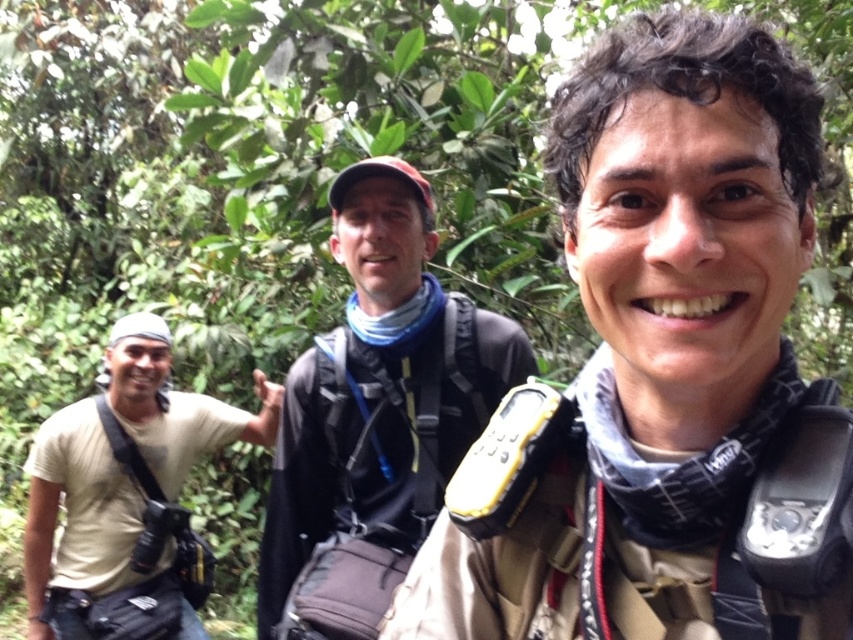
Which is behind, point (695, 248) or point (178, 625)?

The point (178, 625) is more distant.

Between matte black backpack at center and light beige t-shirt at left, which one is positioned higher?

Positioned higher is matte black backpack at center.

Where is `matte black backpack at center`? matte black backpack at center is located at coordinates (663, 374).

The height and width of the screenshot is (640, 853). Describe the element at coordinates (663, 374) in the screenshot. I see `matte black backpack at center` at that location.

Is point (822, 384) more distant than point (392, 442)?

No, (822, 384) is in front of (392, 442).

Locate an element on the screen. The height and width of the screenshot is (640, 853). matte black backpack at center is located at coordinates (663, 374).

Looking at this image, does matte black jacket at center have a larger size compared to light beige t-shirt at left?

No, matte black jacket at center is not bigger than light beige t-shirt at left.

Does matte black jacket at center have a greater height compared to light beige t-shirt at left?

Yes.

Is point (415, 394) positioned after point (178, 410)?

No, it is not.

You are a GUI agent. You are given a task and a screenshot of the screen. Output one action in this format:
    pyautogui.click(x=<x>, y=<y>)
    Task: Click on the matte black jacket at center
    The image size is (853, 640).
    Given the screenshot: What is the action you would take?
    pyautogui.click(x=376, y=410)